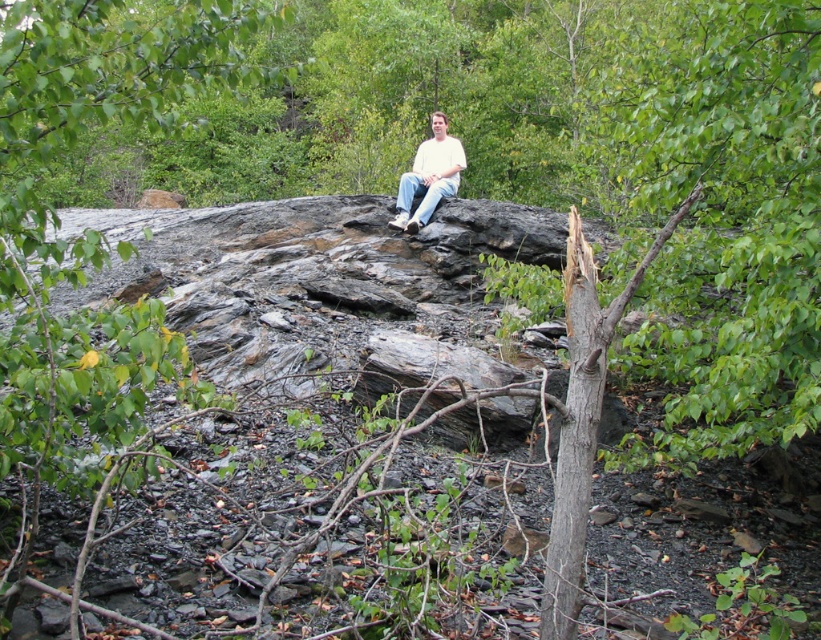
You are standing in the forest and want to take a photo of the gray rough bark tree trunk at right. Since you are near the man sitting on the rock, where should you position yourself relative to him to capture the tree trunk in your shot?

The gray rough bark tree trunk at right is located at point [576,436], which means it is positioned towards the upper right of the frame. To capture it in your photo while standing near the man, you should move to his right side and aim your camera upwards slightly to include the tree trunk in the shot.

You are a photographer trying to capture the scene with a wide angle lens. Since the gray rough bark tree trunk at right and the white matte shirt at center are both in your frame, which object will appear smaller in your photo?

The gray rough bark tree trunk at right occupies less space than the white matte shirt at center, so it will appear smaller in the photo.